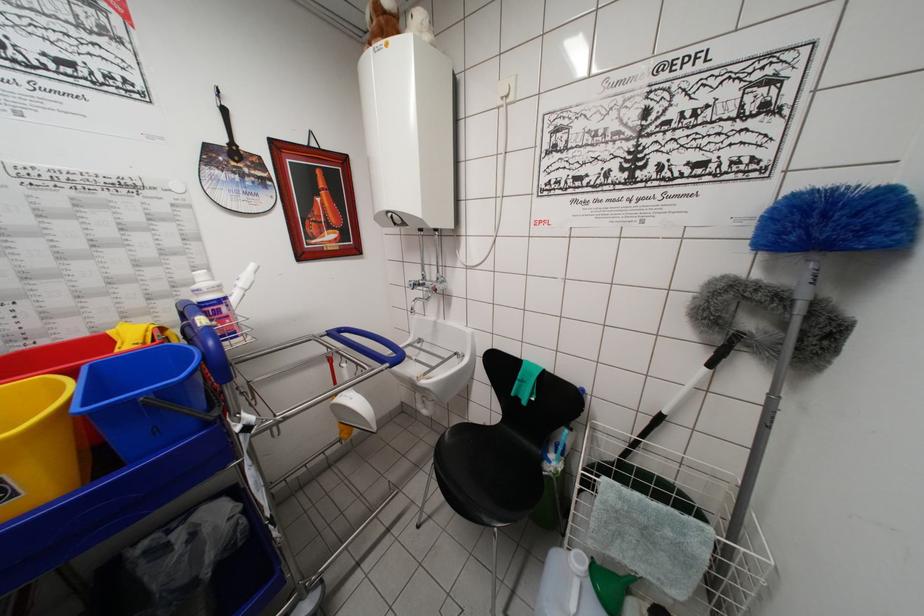
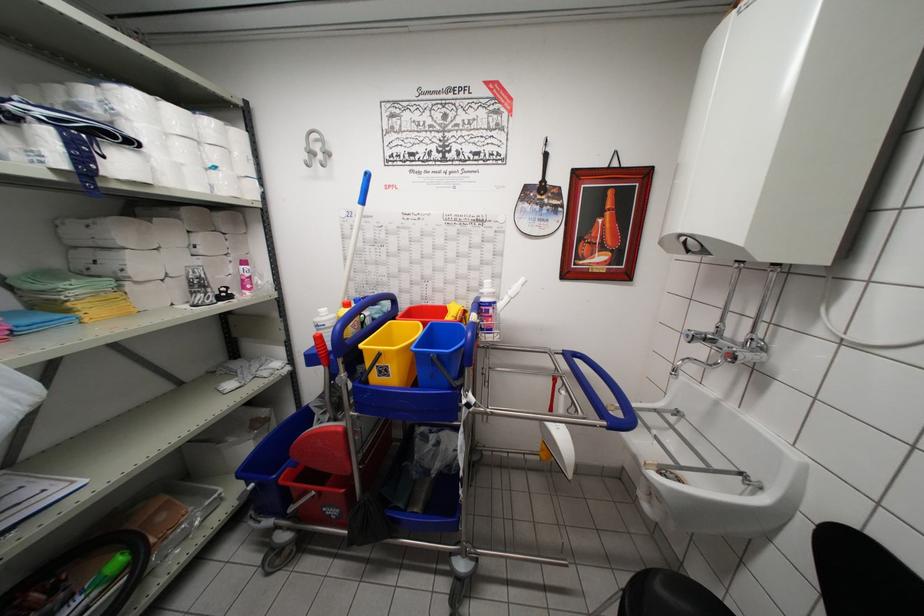
Question: The first image is from the beginning of the video and the second image is from the end. How did the camera likely rotate when shooting the video?

Choices:
 (A) Left
 (B) Right
 (C) Up
 (D) Down

Answer: (A)